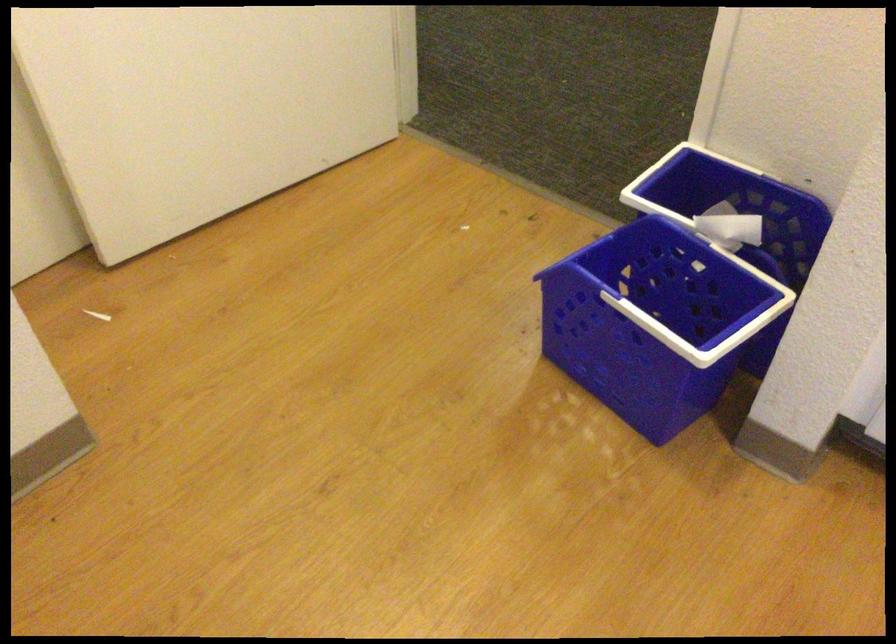
Find the location of `crumpled white paper`. crumpled white paper is located at coordinates (729, 223).